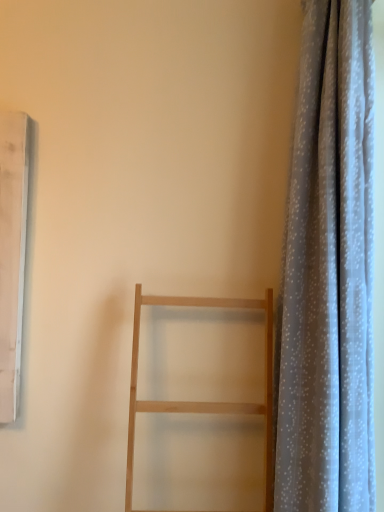
Question: Relative to light gray sheer curtain at right, is natural wood ladder at center in front or behind?

Choices:
 (A) behind
 (B) front

Answer: (B)

Question: In terms of height, does natural wood ladder at center look taller or shorter compared to light gray sheer curtain at right?

Choices:
 (A) tall
 (B) short

Answer: (B)

Question: Is point (228, 412) closer or farther from the camera than point (364, 73)?

Choices:
 (A) farther
 (B) closer

Answer: (A)

Question: Relative to natural wood ladder at center, is light gray sheer curtain at right in front or behind?

Choices:
 (A) behind
 (B) front

Answer: (A)

Question: Considering the relative positions of light gray sheer curtain at right and natural wood ladder at center in the image provided, is light gray sheer curtain at right to the left or to the right of natural wood ladder at center?

Choices:
 (A) left
 (B) right

Answer: (B)

Question: Does point (360, 396) appear closer or farther from the camera than point (215, 411)?

Choices:
 (A) closer
 (B) farther

Answer: (A)

Question: From a real-world perspective, is light gray sheer curtain at right positioned above or below natural wood ladder at center?

Choices:
 (A) above
 (B) below

Answer: (A)